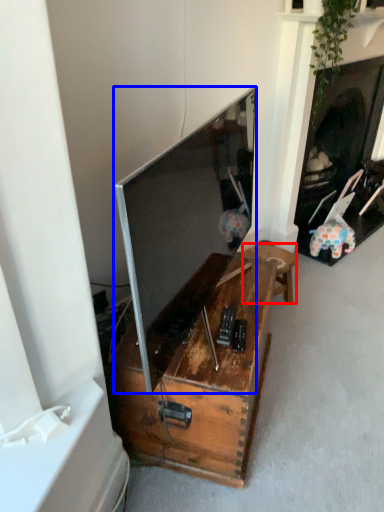
Question: Among these objects, which one is nearest to the camera, furniture (highlighted by a red box) or television (highlighted by a blue box)?

Choices:
 (A) furniture
 (B) television

Answer: (B)